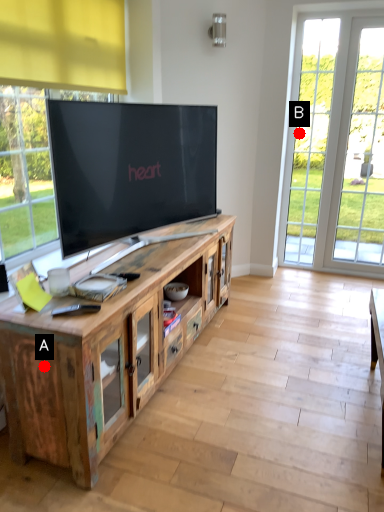
Question: Two points are circled on the image, labeled by A and B beside each circle. Which of the following is the closest to the observer?

Choices:
 (A) A is closer
 (B) B is closer

Answer: (A)